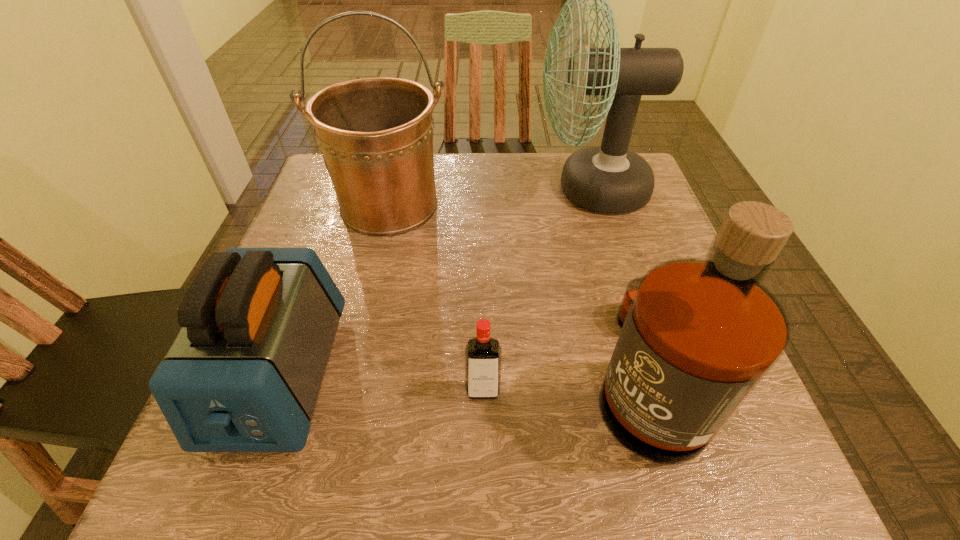
You are a GUI agent. You are given a task and a screenshot of the screen. Output one action in this format:
    pyautogui.click(x=<x>, y=<y>)
    Task: Click on the vacant space at the near left corner of the desktop
    Image resolution: width=960 pixels, height=540 pixels.
    Given the screenshot: What is the action you would take?
    pyautogui.click(x=206, y=465)

Image resolution: width=960 pixels, height=540 pixels. What are the coordinates of `blank space at the near right corner of the desktop` in the screenshot? It's located at (756, 485).

Where is `free space between the shortest object and the liquor`? free space between the shortest object and the liquor is located at coordinates (564, 382).

Locate an element on the screen. The width and height of the screenshot is (960, 540). unoccupied position between the fan and the liquor is located at coordinates (617, 281).

The width and height of the screenshot is (960, 540). I want to click on free space between the fan and the bucket, so click(490, 198).

What are the coordinates of `blank region between the third object from left to right and the fan` in the screenshot? It's located at (537, 290).

Locate an element on the screen. The image size is (960, 540). empty location between the fan and the shortest object is located at coordinates (537, 290).

Identify the location of free spot between the third object from right to left and the bucket. This screenshot has width=960, height=540. (436, 298).

Identify the location of unoccupied area between the toaster and the liquor. This screenshot has height=540, width=960. (462, 375).

Image resolution: width=960 pixels, height=540 pixels. I want to click on vacant area that lies between the bucket and the fan, so click(x=490, y=198).